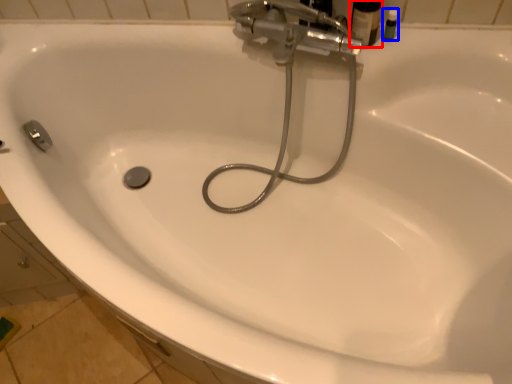
Question: Which object appears closest to the camera in this image, toiletry (highlighted by a red box) or toiletry (highlighted by a blue box)?

Choices:
 (A) toiletry
 (B) toiletry

Answer: (A)